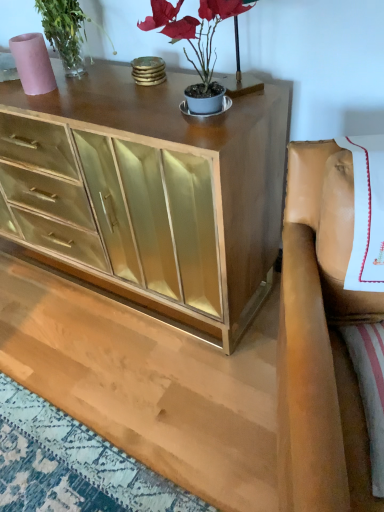
Where is `free space below matte gold plant at upper center (from a real-world perspective)`? The image size is (384, 512). free space below matte gold plant at upper center (from a real-world perspective) is located at coordinates (203, 122).